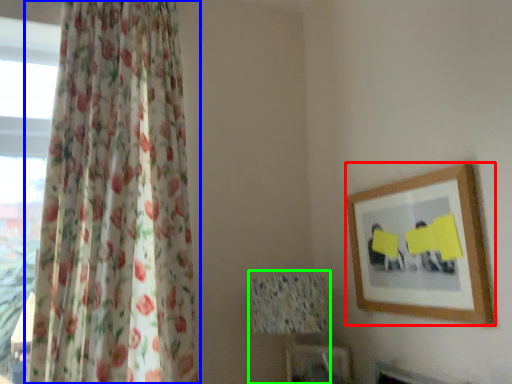
Question: Estimate the real-world distances between objects in this image. Which object is farther from picture frame (highlighted by a red box), curtain (highlighted by a blue box) or table lamp (highlighted by a green box)?

Choices:
 (A) curtain
 (B) table lamp

Answer: (A)